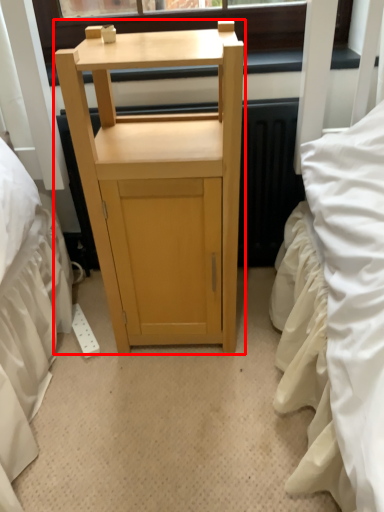
Question: Considering the relative positions of furniture (annotated by the red box) and window screen in the image provided, where is furniture (annotated by the red box) located with respect to the staircase?

Choices:
 (A) right
 (B) left

Answer: (B)